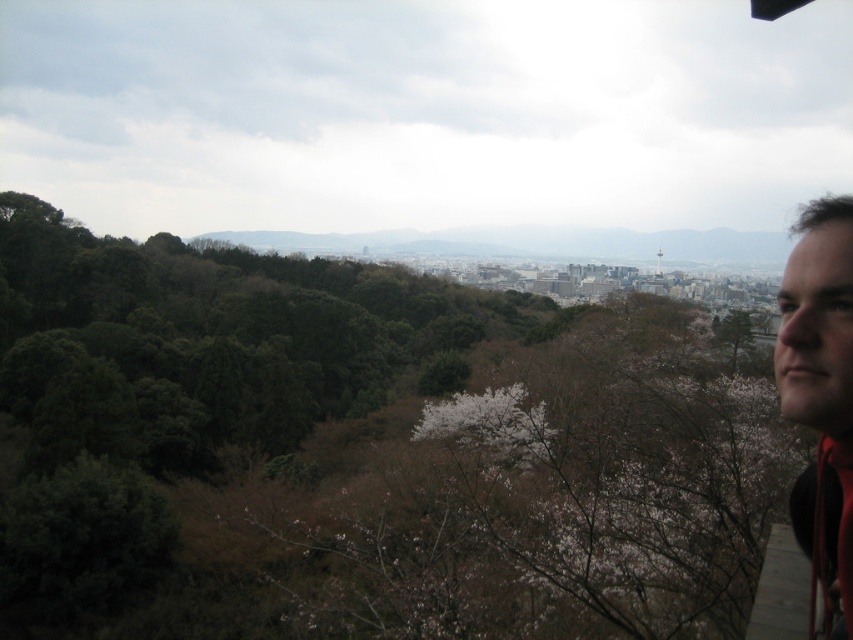
Question: Observing the image, what is the correct spatial positioning of green matte tree at upper right in reference to matte black hair at upper right?

Choices:
 (A) left
 (B) right

Answer: (A)

Question: Which object is farther from the camera taking this photo?

Choices:
 (A) matte black hair at upper right
 (B) green matte tree at upper right

Answer: (B)

Question: Can you confirm if green matte tree at upper right is wider than matte black hair at upper right?

Choices:
 (A) yes
 (B) no

Answer: (A)

Question: Considering the relative positions of green matte tree at upper right and matte black hair at upper right in the image provided, where is green matte tree at upper right located with respect to matte black hair at upper right?

Choices:
 (A) below
 (B) above

Answer: (B)

Question: Which point is farther to the camera?

Choices:
 (A) (805, 342)
 (B) (737, 376)

Answer: (B)